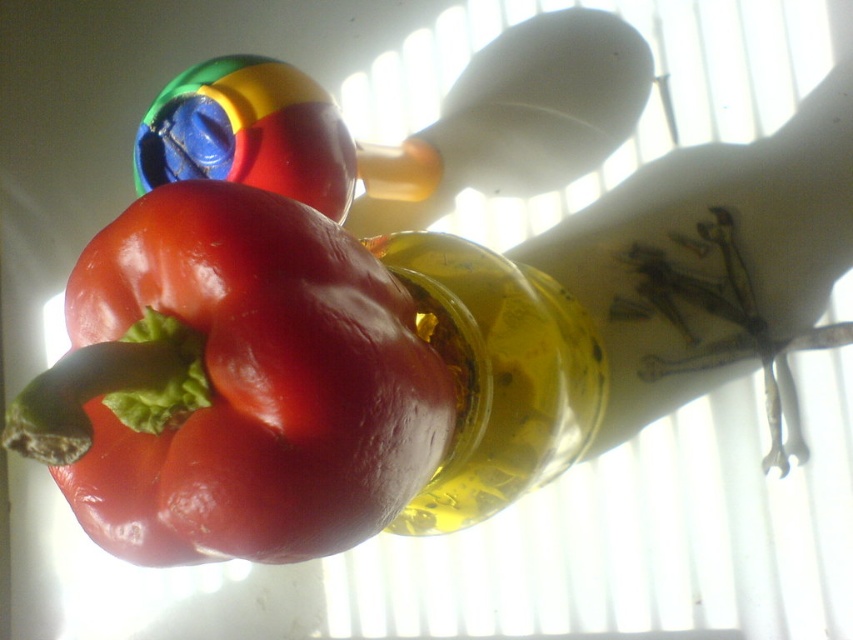
You are organizing items on a kitchen counter and need to place a small spice jar between the shiny red bell pepper at center and the translucent yellow bottle at center. Based on their positions, where should you place the spice jar?

The shiny red bell pepper at center is located above the translucent yellow bottle at center, so you should place the spice jar between them in the space below the pepper and above the bottle.